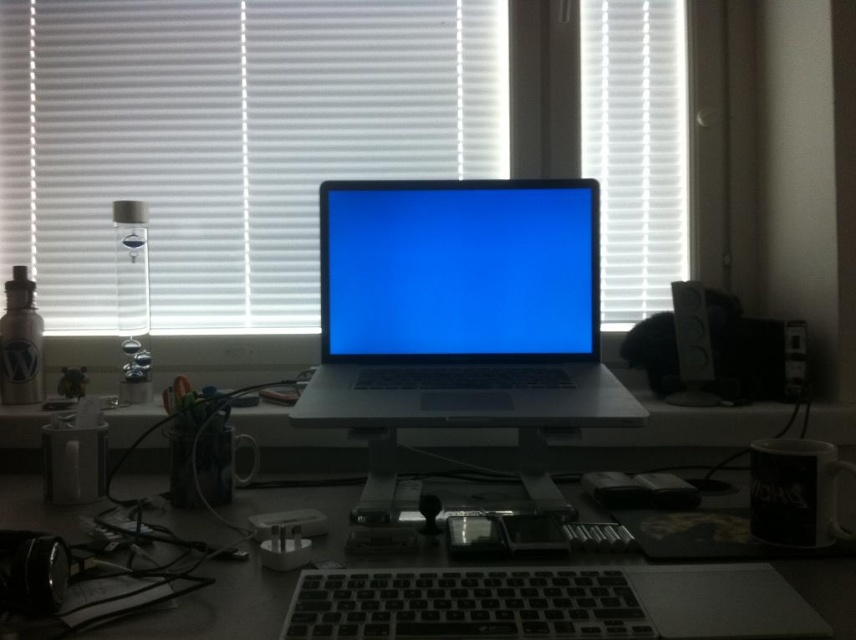
You are trying to locate the point with coordinates (461, 307) in the workspace. Based on the scene description, where is this point located?

The point with coordinates (461, 307) is located on the sleek silver laptop at center.